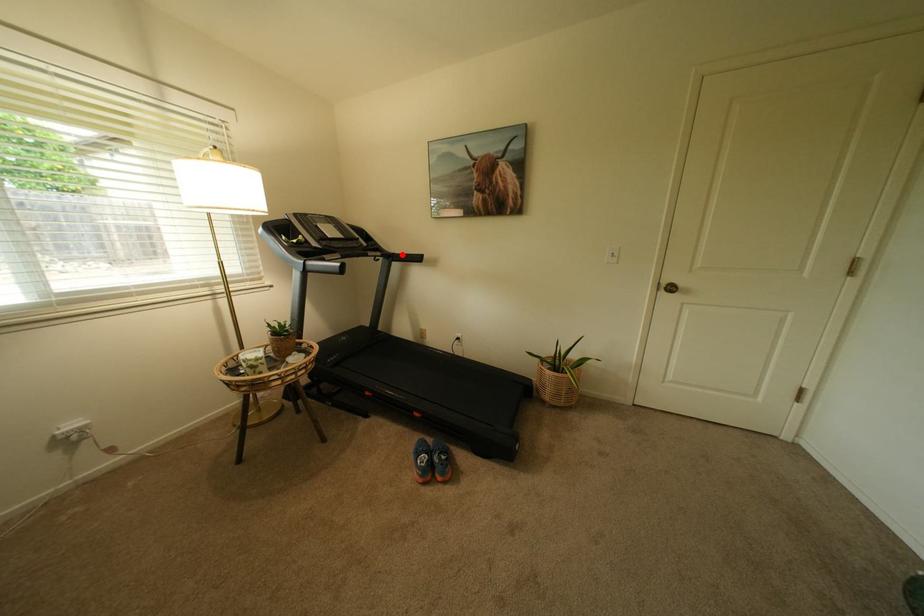
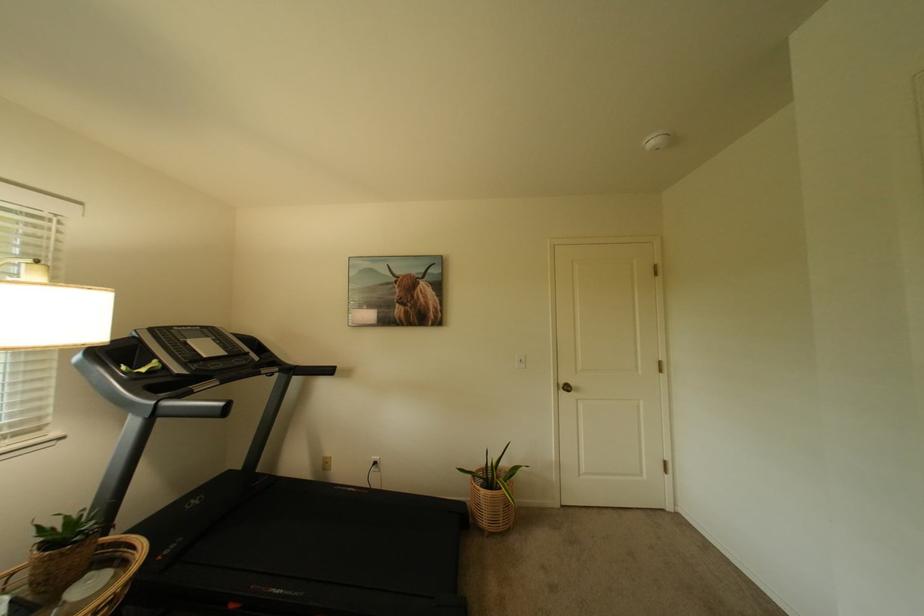
Where in the second image is the point corresponding to the highlighted location from the first image?

(305, 368)